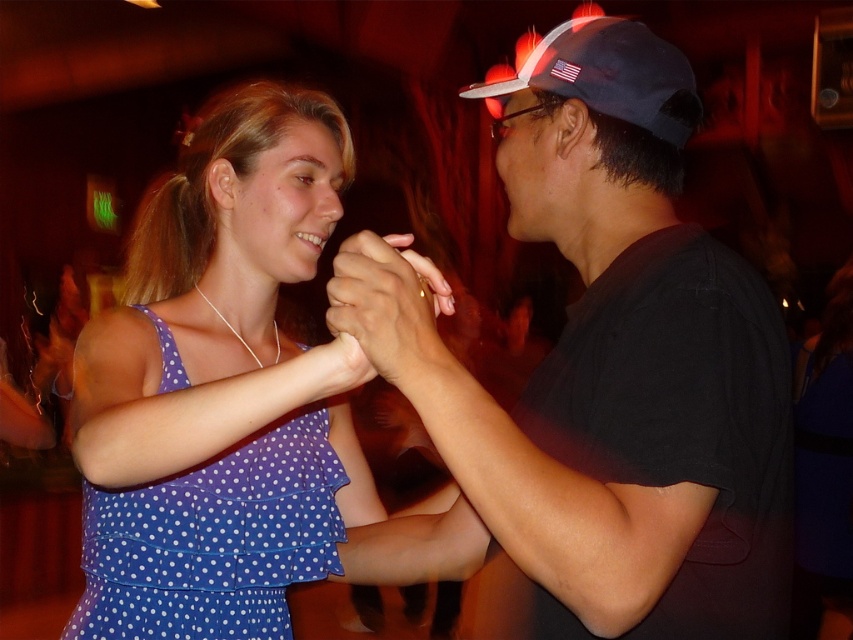
Question: Considering the relative positions of black matte shirt at center and blue polka dot fabric dress at center in the image provided, where is black matte shirt at center located with respect to blue polka dot fabric dress at center?

Choices:
 (A) left
 (B) right

Answer: (B)

Question: Is black matte shirt at center thinner than matte skin at center?

Choices:
 (A) yes
 (B) no

Answer: (B)

Question: Which point is farther to the camera?

Choices:
 (A) (224, 401)
 (B) (345, 298)
 (C) (577, 188)
 (D) (254, 456)

Answer: (D)

Question: Which point is closer to the camera taking this photo?

Choices:
 (A) (135, 609)
 (B) (415, 353)
 (C) (679, 129)

Answer: (B)

Question: Which of the following is the closest to the observer?

Choices:
 (A) (386, 310)
 (B) (129, 388)
 (C) (677, 618)

Answer: (A)

Question: Can you confirm if black matte shirt at center is smaller than blue fabric baseball cap at upper right?

Choices:
 (A) yes
 (B) no

Answer: (B)